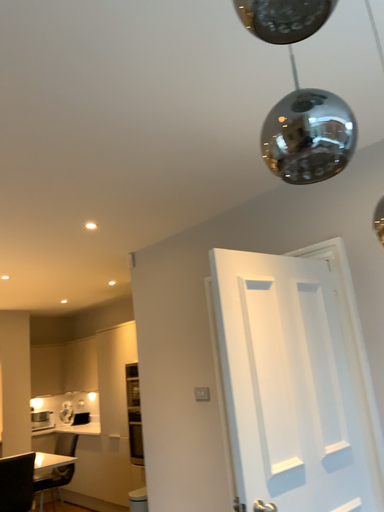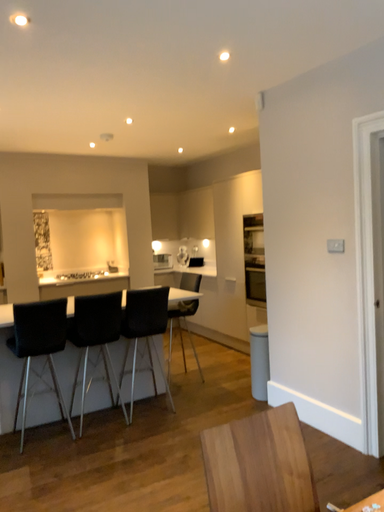
Question: How did the camera likely rotate when shooting the video?

Choices:
 (A) rotated left
 (B) rotated right

Answer: (A)